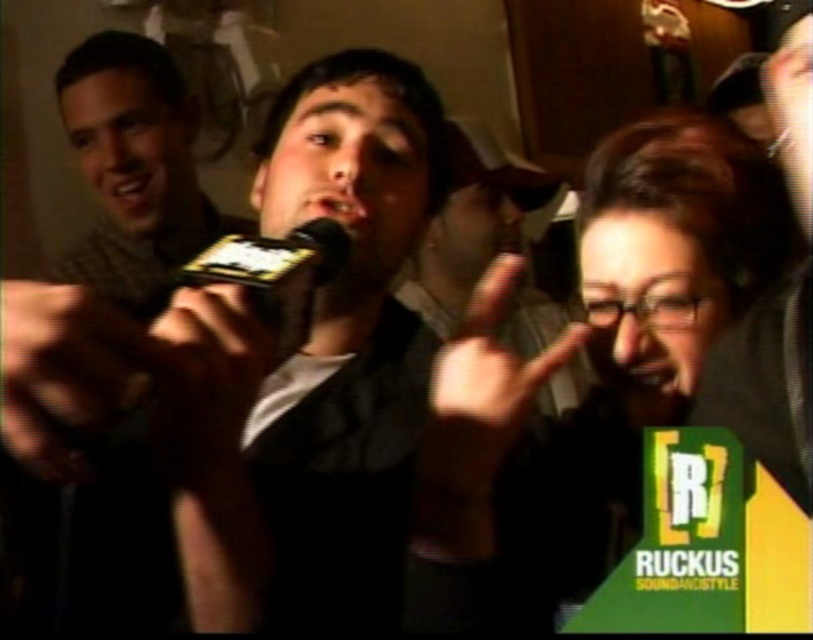
Based on the scene description, where is the matte black microphone at center located in terms of coordinates?

The matte black microphone at center is located at coordinates point [133,168].

You are at a social event and see the black matte hand at lower left and the black plastic microphone at center. Which object is positioned more to the left side of the scene?

The black matte hand at lower left is positioned more to the left side of the scene than the black plastic microphone at center.

You are at a social event and see a person holding a microphone. There is a black matte hand at lower left represented by point (62, 372). Is the hand closer to the microphone holder or the person pointing towards them?

The black matte hand at lower left represented by point (62, 372) is closer to the person pointing towards them.